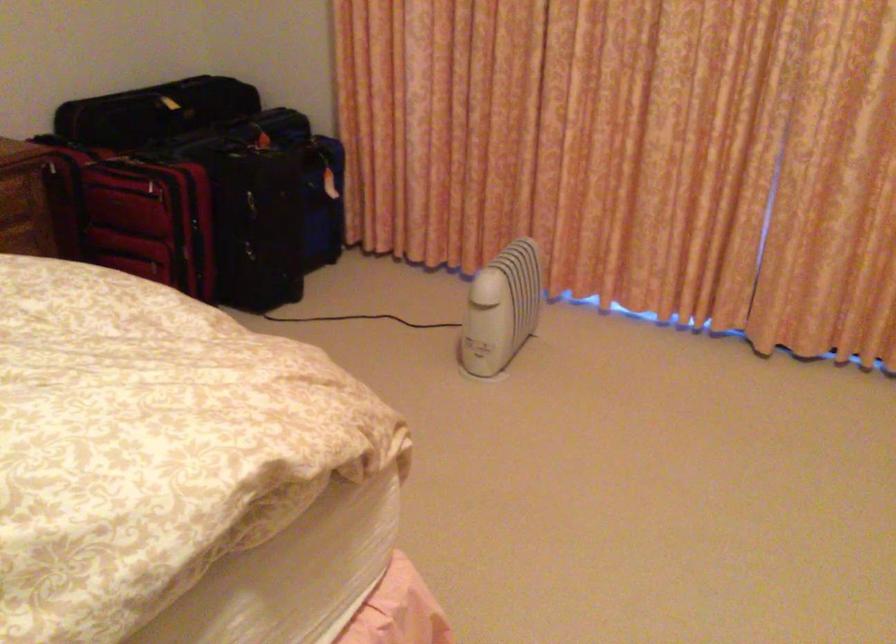
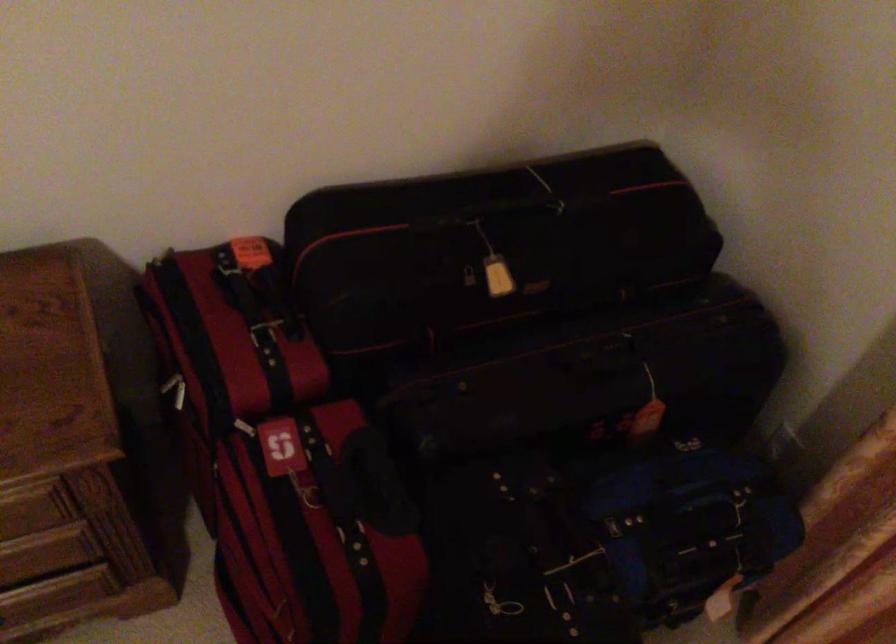
Find the pixel in the second image that matches the point at 80,149 in the first image.

(264, 334)